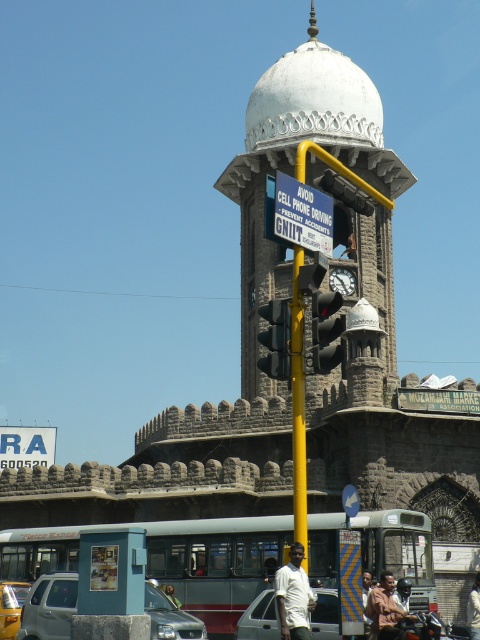
Question: Estimate the real-world distances between objects in this image. Which object is closer to the white stone clock tower at center?

Choices:
 (A) metallic rectangular sign at center
 (B) yellow metallic pole at center
 (C) light beige fabric shirt at center

Answer: (B)

Question: Among these objects, which one is nearest to the camera?

Choices:
 (A) shiny chrome motorcycle at center
 (B) light beige fabric shirt at center
 (C) black plastic traffic light at center

Answer: (B)

Question: Is metallic rectangular sign at center closer to camera compared to black glass traffic light at center?

Choices:
 (A) yes
 (B) no

Answer: (B)

Question: Is black glass traffic light at center positioned at the back of white matte helmet at upper center?

Choices:
 (A) no
 (B) yes

Answer: (A)

Question: Among these points, which one is farthest from the camera?

Choices:
 (A) (177, 600)
 (B) (172, 624)
 (C) (379, 636)
 (D) (380, 170)

Answer: (D)

Question: Does light beige fabric shirt at center appear on the left side of dark gray stone clock at center?

Choices:
 (A) yes
 (B) no

Answer: (A)